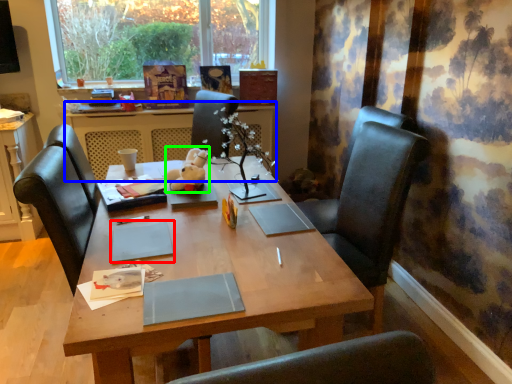
Question: Which object is positioned farthest from notebook (highlighted by a red box)? Select from table (highlighted by a blue box) and toy (highlighted by a green box).

Choices:
 (A) table
 (B) toy

Answer: (A)